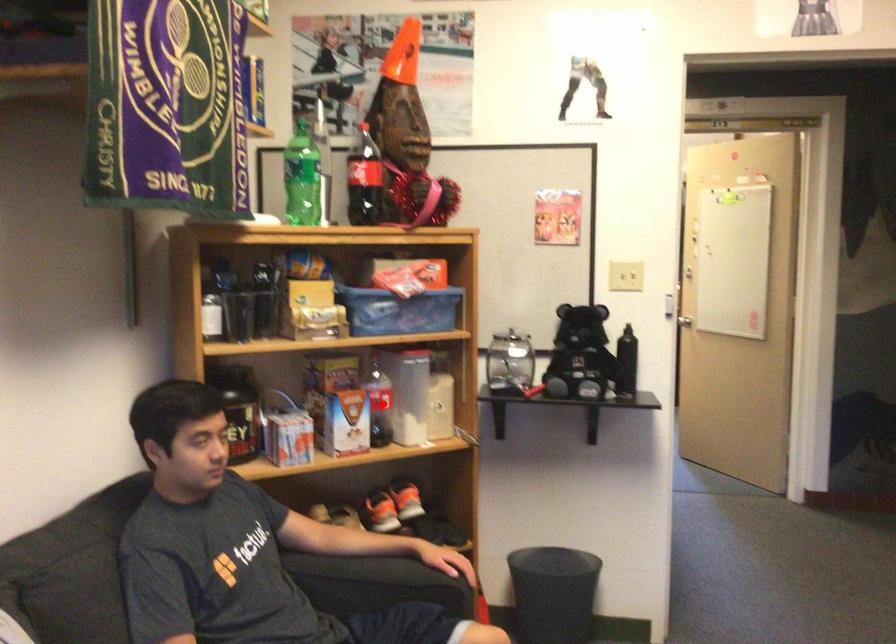
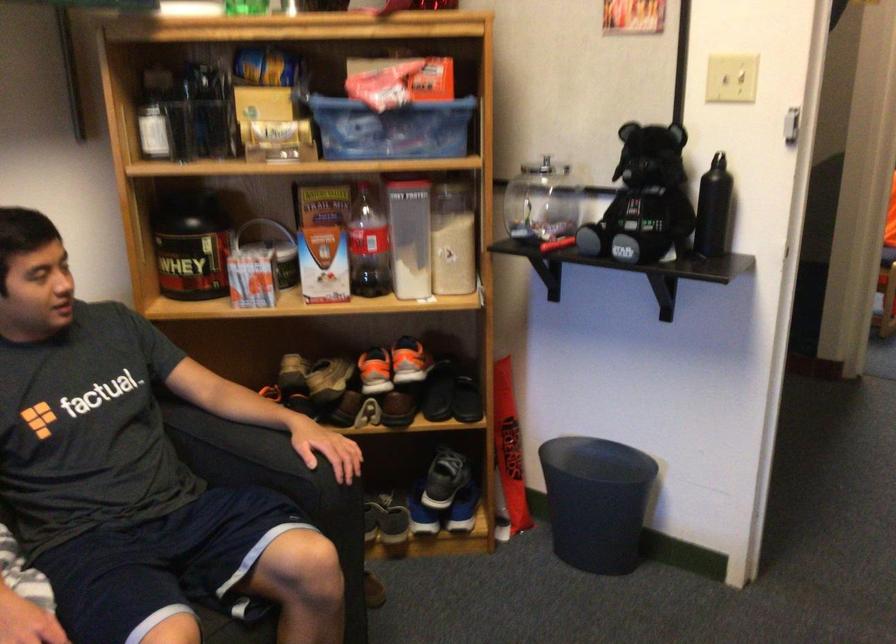
Find the pixel in the second image that matches the highlighted location in the first image.

(367, 245)